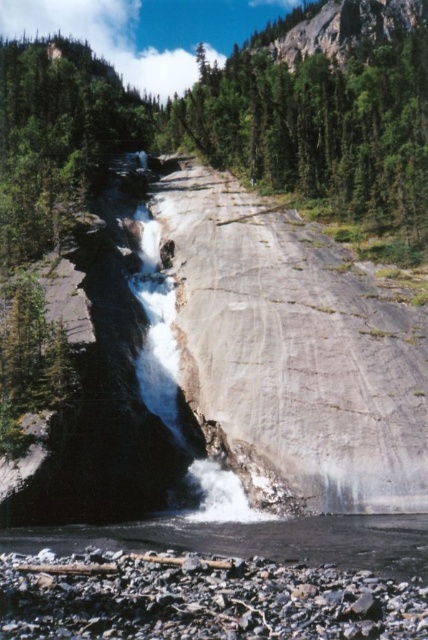
You are a hiker planning to cross from the green leafy tree at center to the smooth gray rock at lower center. Given that your average walking pace is 1.5 meters per second, how many seconds will it take you to walk directly between them?

The distance between the green leafy tree at center and the smooth gray rock at lower center is 148.80 meters. At a walking pace of 1.5 meters per second, it would take approximately 99.2 seconds to walk directly between them.

You are standing at the base of the waterfall and want to take a photo of the green leafy tree at center. Where should you position yourself to capture the tree in the center of your camera frame?

To capture the green leafy tree at center in the center of your camera frame, position yourself directly in front of the tree at point (323, 112).

You are standing at the edge of the pool below the waterfall. You see a green leafy tree at center and a smooth gray rock at lower center. Which object is closer to you?

The smooth gray rock at lower center is behind the green leafy tree at center, so the green leafy tree at center is closer to you.